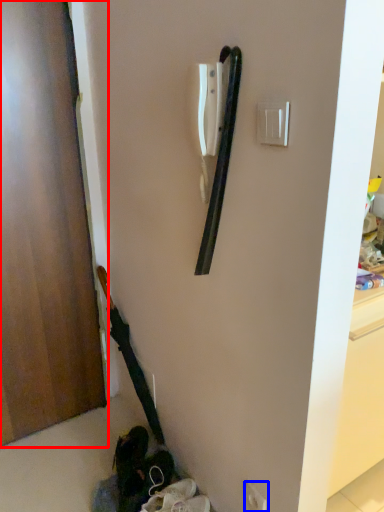
Question: Among these objects, which one is farthest to the camera, door (highlighted by a red box) or electric outlet (highlighted by a blue box)?

Choices:
 (A) door
 (B) electric outlet

Answer: (B)